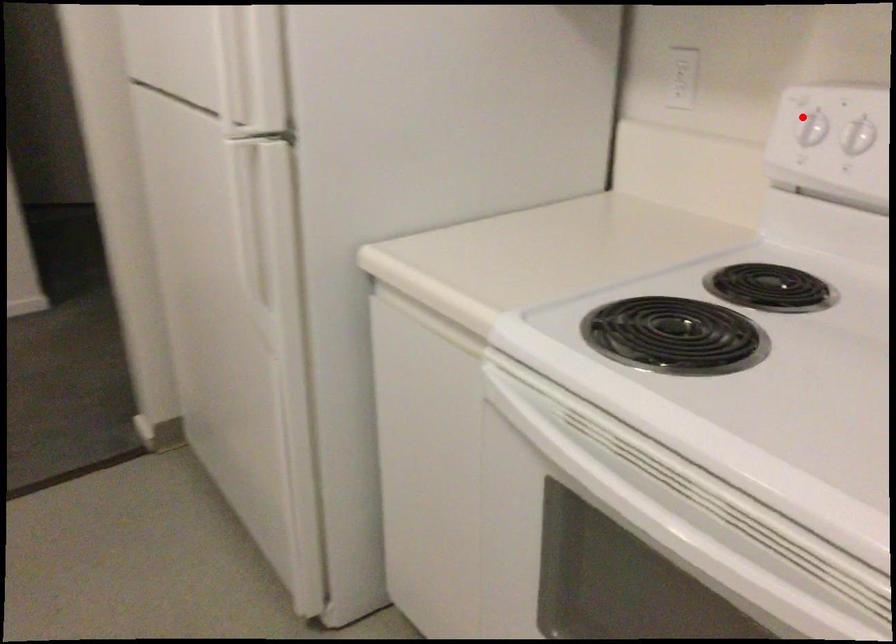
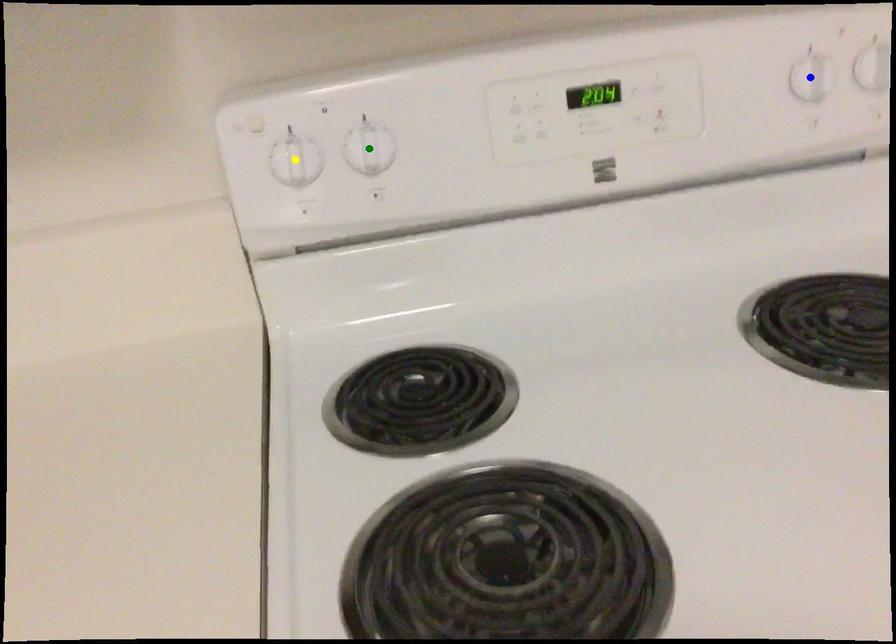
Question: I am providing you with two images of the same scene from different viewpoints. A red point is marked on the first image. You are given multiple points on the second image. Which spot in image 2 lines up with the point in image 1?

Choices:
 (A) blue point
 (B) yellow point
 (C) green point

Answer: (B)